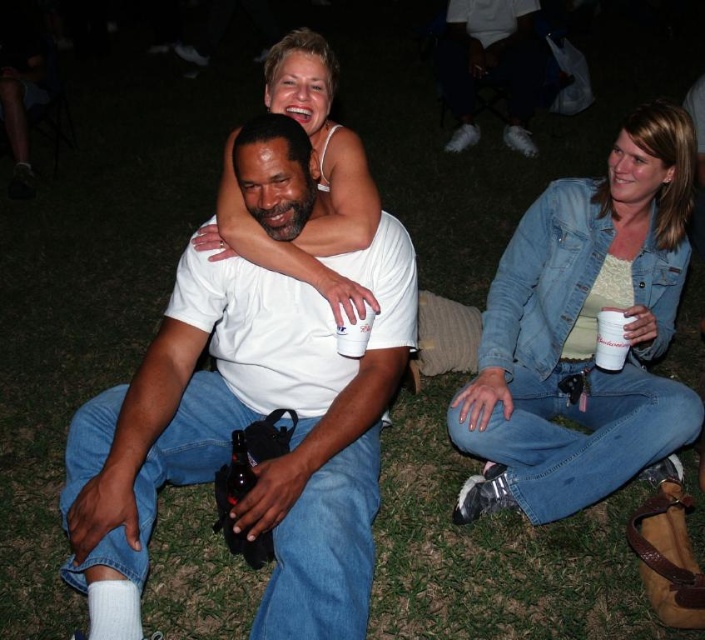
Based on the coordinates provided, which object is located at point [240,428]?

The point [240,428] corresponds to the white matte t shirt at center.

You are a photographer at the event and need to place a small tripod between the denim jacket at lower right and the white plastic cup at lower right. Can you fit it there?

The denim jacket at lower right is located above the white plastic cup at lower right, so there is space between them to place the tripod.